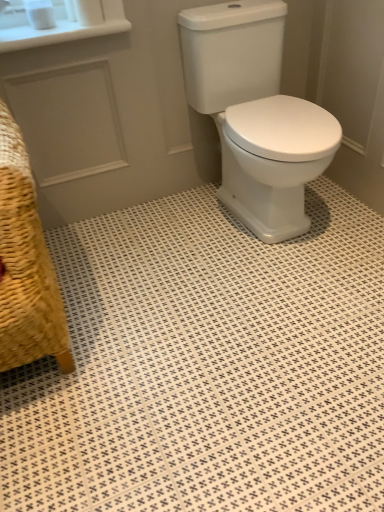
This screenshot has width=384, height=512. What are the coordinates of `vacant area located to the right-hand side of woven straw armchair at lower left` in the screenshot? It's located at (162, 300).